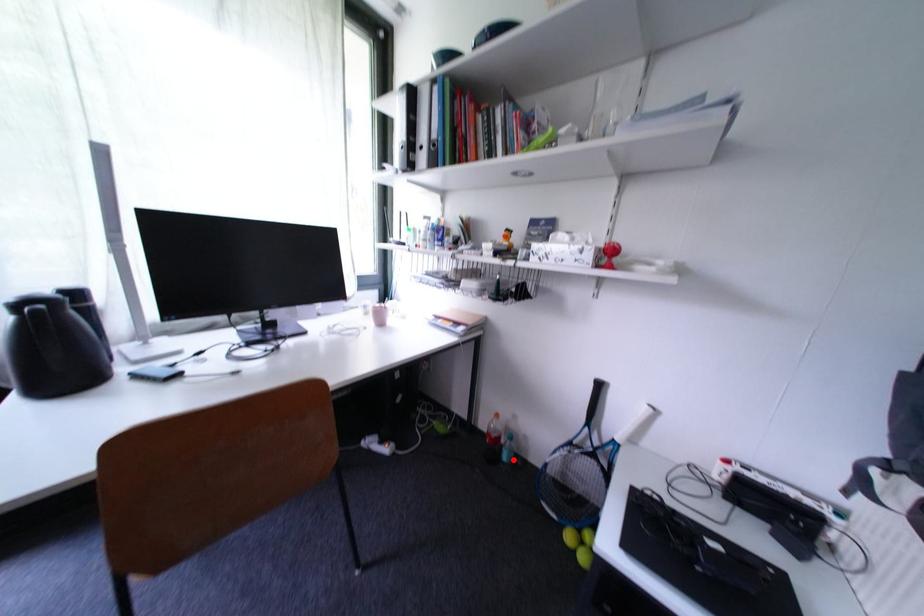
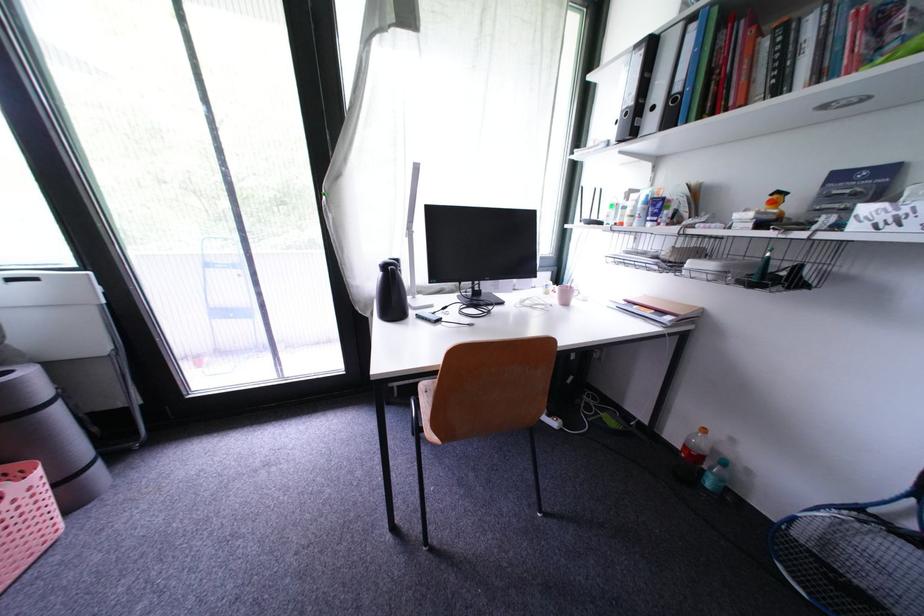
In the second image, find the point that corresponds to the highlighted location in the first image.

(718, 485)